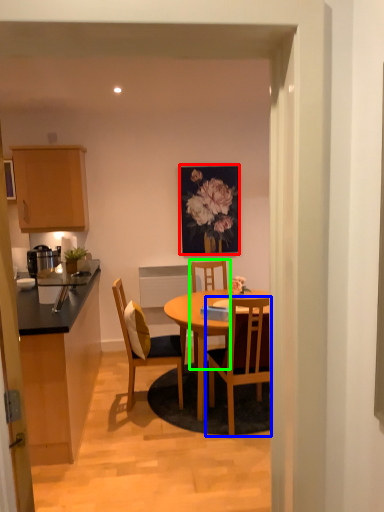
Question: Which is farther away from picture frame (highlighted by a red box)? chair (highlighted by a blue box) or chair (highlighted by a green box)?

Choices:
 (A) chair
 (B) chair

Answer: (A)